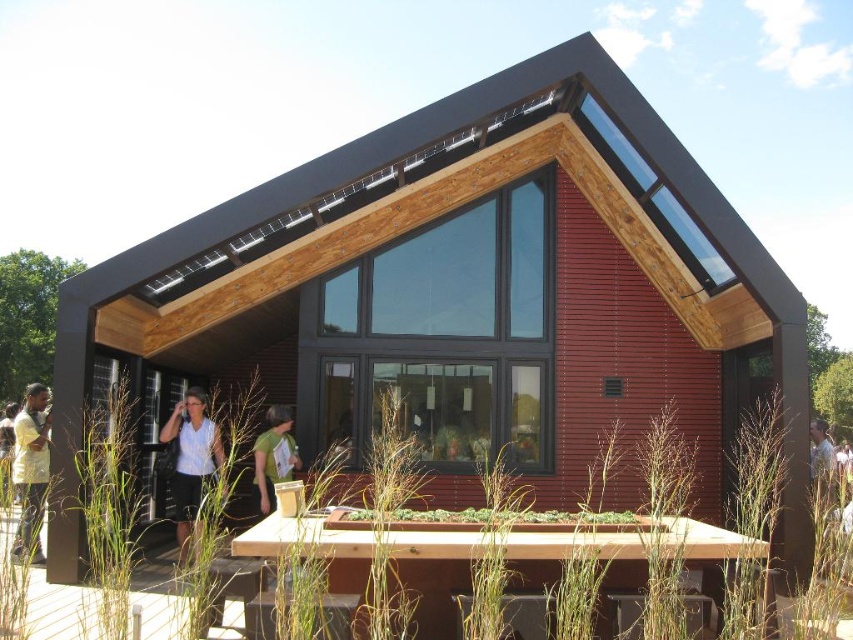
You are a passerby looking at the building and notice two shirts hanging on a rack outside. The light yellow shirt at left and the green fabric shirt at center. Which shirt is covering part of the other?

The light yellow shirt at left is positioned over the green fabric shirt at center, so it is covering part of the green fabric shirt at center.

You are standing in front of the modern eco building and want to take a photo. You notice two points marked in the scene. The first point is at coordinate point [190,532] and the second is at point [814,445]. Which point will appear larger in your camera view?

Point [190,532] is closer to the camera than point [814,445], so it will appear larger in the camera view.

You are standing in front of the building and want to hand a document to the person wearing the light yellow shirt at left and the green fabric shirt at center. Which shirt should you approach first to hand the document?

You should approach the light yellow shirt at left first because it is closer to you than the green fabric shirt at center.